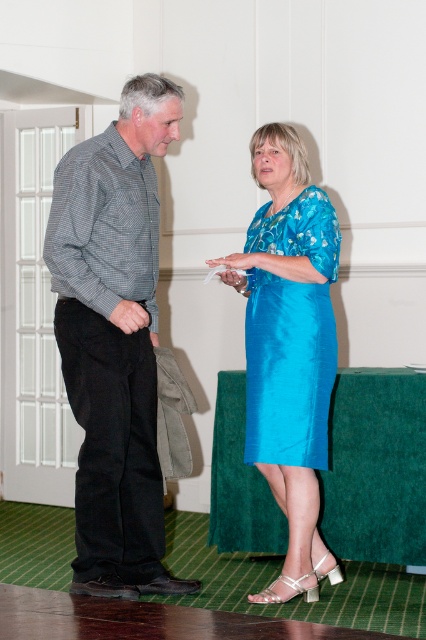
Question: Can you confirm if checkered fabric shirt at left is wider than turquoise silk dress at center?

Choices:
 (A) yes
 (B) no

Answer: (A)

Question: Which point appears farthest from the camera in this image?

Choices:
 (A) (313, 449)
 (B) (123, 316)

Answer: (A)

Question: Among these points, which one is farthest from the camera?

Choices:
 (A) (135, 320)
 (B) (273, 385)

Answer: (B)

Question: Which object is the closest to the shiny blue dress at center?

Choices:
 (A) turquoise silk dress at center
 (B) matte black hand at center
 (C) matte blue dress at center

Answer: (A)

Question: Can you confirm if matte black hand at center is thinner than matte blue dress at center?

Choices:
 (A) no
 (B) yes

Answer: (B)

Question: Is checkered fabric shirt at left below turquoise silk dress at center?

Choices:
 (A) no
 (B) yes

Answer: (B)